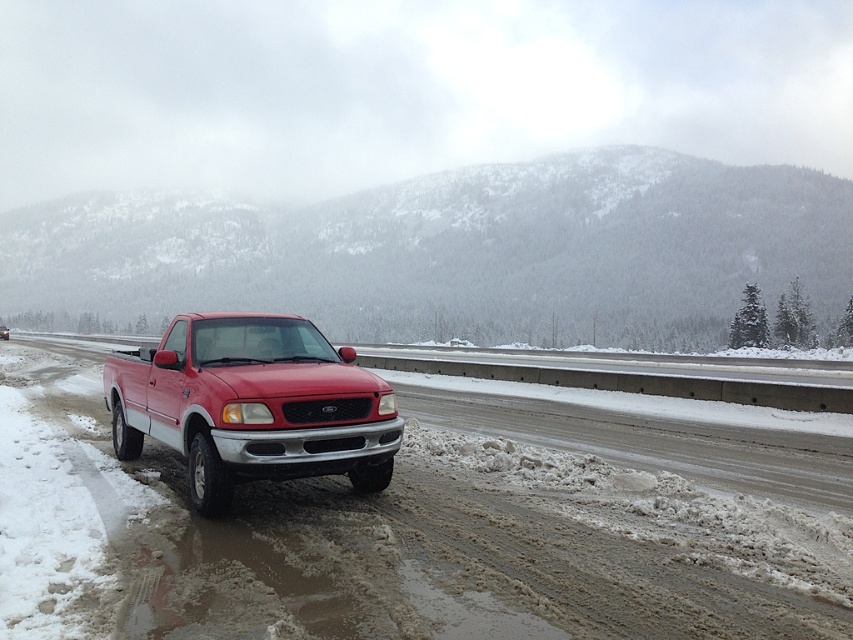
You are a hiker planning to take a photo of the snowy forested mountain at upper center and the matte red pickup truck at center. Which object should you focus on first if you want to capture both in a single frame without moving your camera?

You should focus on the snowy forested mountain at upper center first because it is located above the matte red pickup truck at center, so adjusting focus from top to bottom will help capture both in one frame.